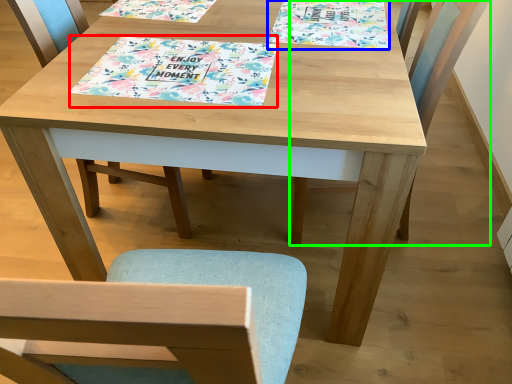
Question: Based on their relative distances, which object is nearer to tablecloth (highlighted by a red box)? Choose from book cover (highlighted by a blue box) and chair (highlighted by a green box).

Choices:
 (A) book cover
 (B) chair

Answer: (A)